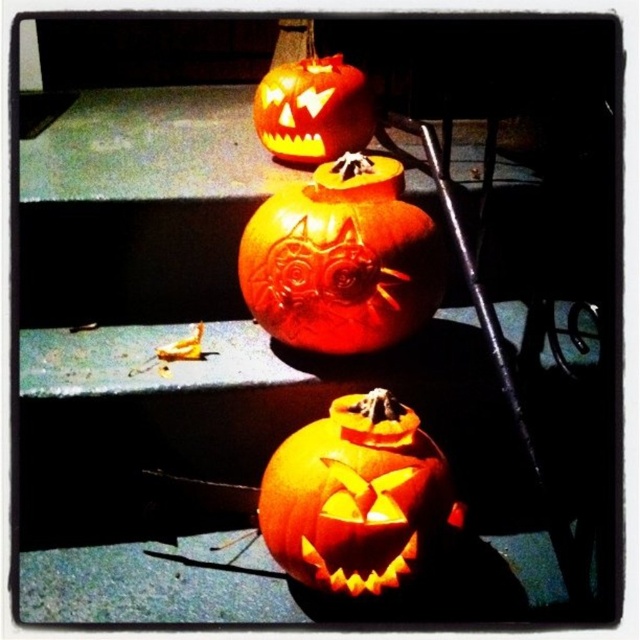
Where is the orange carved pumpkin at center located in the image?

The orange carved pumpkin at center is located at point [340,259].

You are standing in front of the festive display and want to place a small candle on the pumpkin that is above the other. Which pumpkin should you choose between the orange carved pumpkin at center and the orange matte pumpkin at center?

The orange carved pumpkin at center is positioned over orange matte pumpkin at center, so you should choose the orange carved pumpkin at center to place the candle as it is above the other.

You are setting up a festive display and want to arrange the orange carved pumpkin at center and the orange matte pumpkin at center so that the taller one is in the back for visibility. Based on the scene description, which pumpkin should be placed at the back?

The orange carved pumpkin at center is much taller than the orange matte pumpkin at center, so it should be placed at the back to ensure visibility.